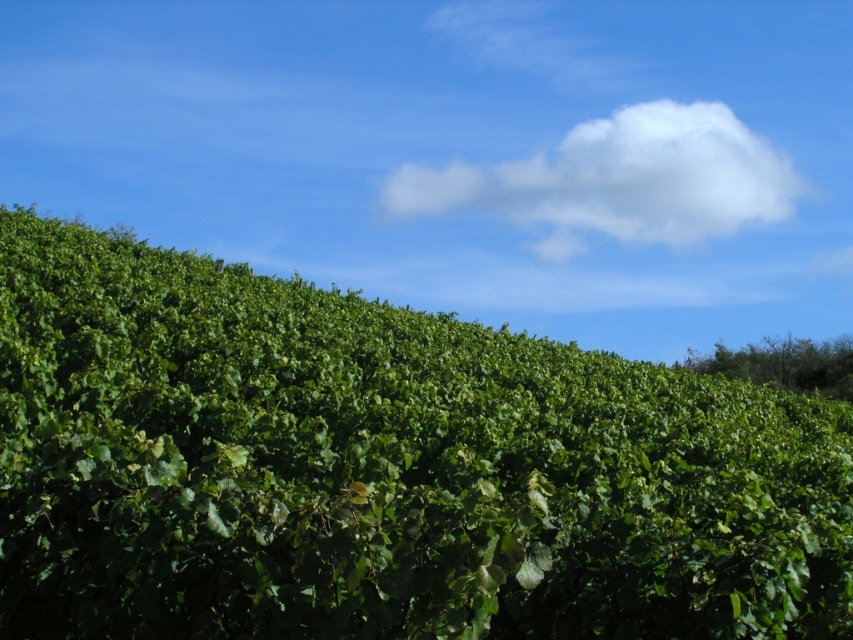
Is point (51, 365) closer to camera compared to point (641, 202)?

Yes, it is in front of point (641, 202).

Which of these two, green leafy hedge at center or white fluffy cloud at upper center, stands taller?

white fluffy cloud at upper center is taller.

Is point (106, 536) behind point (590, 170)?

No, (106, 536) is closer to viewer.

Image resolution: width=853 pixels, height=640 pixels. I want to click on green leafy hedge at center, so click(x=381, y=468).